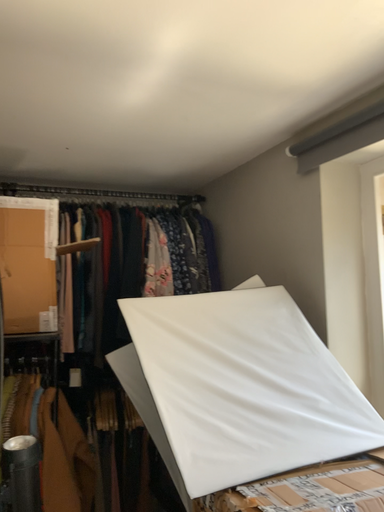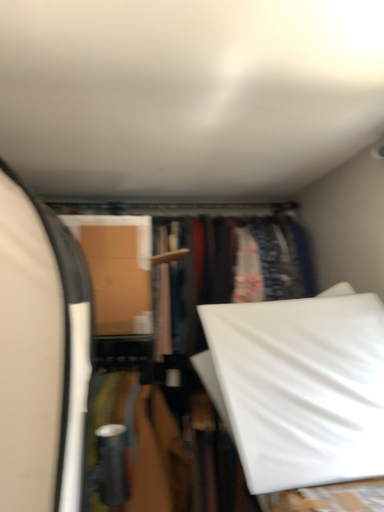
Question: How did the camera likely rotate when shooting the video?

Choices:
 (A) rotated left
 (B) rotated right

Answer: (A)